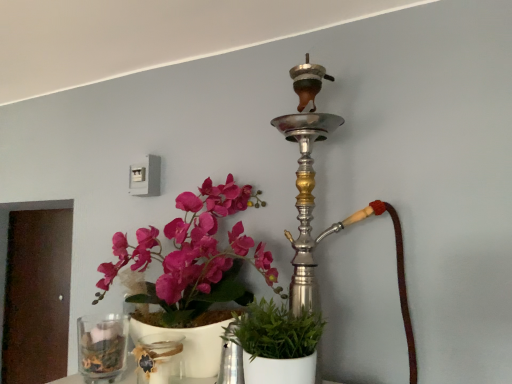
Question: Are transparent glass jar at lower center and green matte plant at center located far from each other?

Choices:
 (A) no
 (B) yes

Answer: (A)

Question: Is transparent glass jar at lower center positioned in front of green matte plant at center?

Choices:
 (A) yes
 (B) no

Answer: (B)

Question: Considering the relative sizes of transparent glass jar at lower center and green matte plant at center in the image provided, is transparent glass jar at lower center thinner than green matte plant at center?

Choices:
 (A) yes
 (B) no

Answer: (A)

Question: From a real-world perspective, is transparent glass jar at lower center physically below green matte plant at center?

Choices:
 (A) no
 (B) yes

Answer: (B)

Question: Is transparent glass jar at lower center facing towards green matte plant at center?

Choices:
 (A) no
 (B) yes

Answer: (A)

Question: From the image's perspective, is transparent glass jar at lower center on top of green matte plant at center?

Choices:
 (A) no
 (B) yes

Answer: (A)

Question: Is green matte plant at center to the left of clear glass vase at lower left from the viewer's perspective?

Choices:
 (A) no
 (B) yes

Answer: (A)

Question: Can we say green matte plant at center lies outside clear glass vase at lower left?

Choices:
 (A) no
 (B) yes

Answer: (B)

Question: Is green matte plant at center positioned behind clear glass vase at lower left?

Choices:
 (A) no
 (B) yes

Answer: (A)

Question: Does green matte plant at center have a greater height compared to clear glass vase at lower left?

Choices:
 (A) no
 (B) yes

Answer: (B)

Question: Is the surface of green matte plant at center in direct contact with clear glass vase at lower left?

Choices:
 (A) yes
 (B) no

Answer: (B)

Question: Is green matte plant at center to the right of clear glass vase at lower left from the viewer's perspective?

Choices:
 (A) no
 (B) yes

Answer: (B)

Question: Does silver metallic hookah at upper center have a smaller size compared to clear glass vase at lower left?

Choices:
 (A) no
 (B) yes

Answer: (A)